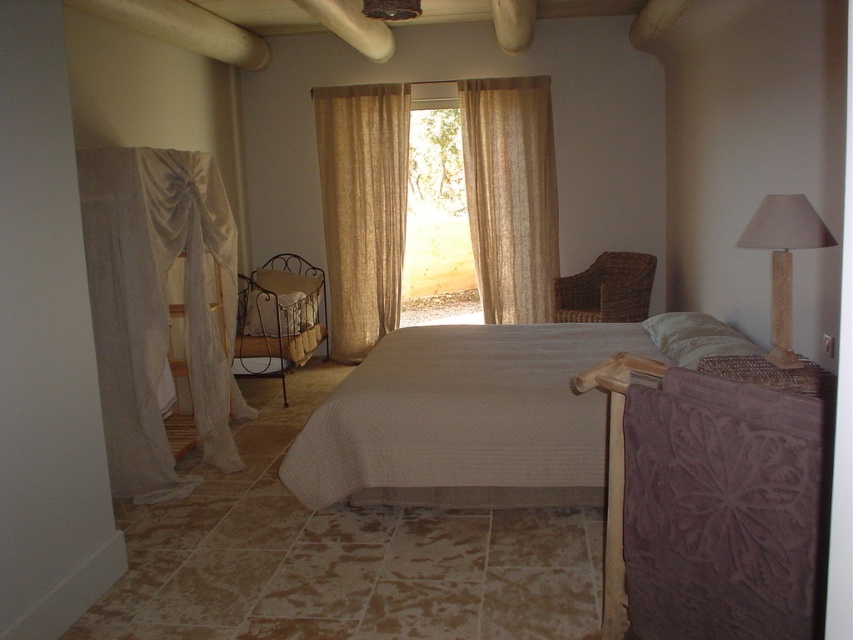
Question: Which of these objects is positioned closest to the beige fabric lampshade at right?

Choices:
 (A) metallic wrought iron cradle at center
 (B) beige linen curtain at center

Answer: (A)

Question: Which of these objects is positioned farthest from the beige fabric lampshade at right?

Choices:
 (A) beige quilted bed at center
 (B) woven brown chair at center right
 (C) metallic wrought iron cradle at center
 (D) translucent beige curtains at center

Answer: (D)

Question: From the image, what is the correct spatial relationship of beige quilted bed at center in relation to beige linen curtain at center?

Choices:
 (A) left
 (B) right

Answer: (B)

Question: Estimate the real-world distances between objects in this image. Which object is closer to the beige linen curtain at center?

Choices:
 (A) translucent beige curtains at center
 (B) beige quilted bed at center
 (C) beige fabric lampshade at right
 (D) woven brown chair at center right

Answer: (A)

Question: From the image, what is the correct spatial relationship of beige linen curtain at center in relation to beige textured curtain at center?

Choices:
 (A) below
 (B) above

Answer: (A)

Question: Does beige linen curtain at center appear under woven brown chair at center right?

Choices:
 (A) yes
 (B) no

Answer: (B)